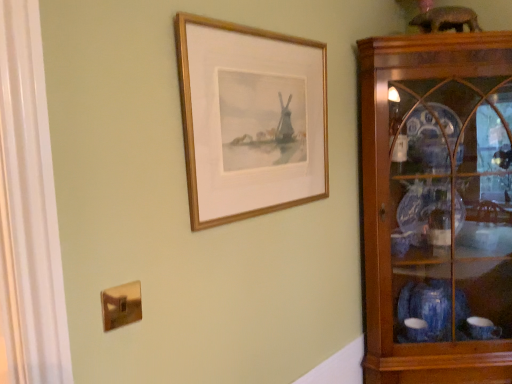
Identify the location of gold wood picture frame at upper center. The width and height of the screenshot is (512, 384). (250, 119).

The height and width of the screenshot is (384, 512). What do you see at coordinates (250, 119) in the screenshot?
I see `gold wood picture frame at upper center` at bounding box center [250, 119].

Measure the distance between gold wood picture frame at upper center and camera.

The depth of gold wood picture frame at upper center is 93.90 centimeters.

Locate an element on the screen. wooden cabinet at right is located at coordinates (437, 207).

Describe the element at coordinates (437, 207) in the screenshot. I see `wooden cabinet at right` at that location.

Where is `gold wood picture frame at upper center`? gold wood picture frame at upper center is located at coordinates (250, 119).

Between wooden cabinet at right and gold wood picture frame at upper center, which one appears on the right side from the viewer's perspective?

wooden cabinet at right.

Between wooden cabinet at right and gold wood picture frame at upper center, which one is positioned behind?

wooden cabinet at right is further away from the camera.

Which is in front, point (415, 309) or point (224, 36)?

The point (224, 36) is in front.

From the image's perspective, which one is positioned higher, wooden cabinet at right or gold wood picture frame at upper center?

gold wood picture frame at upper center.

From a real-world perspective, does wooden cabinet at right stand above gold wood picture frame at upper center?

No, from a real-world perspective, wooden cabinet at right is not over gold wood picture frame at upper center

Which object is wider, wooden cabinet at right or gold wood picture frame at upper center?

With larger width is wooden cabinet at right.

Who is shorter, wooden cabinet at right or gold wood picture frame at upper center?

Standing shorter between the two is gold wood picture frame at upper center.

Between wooden cabinet at right and gold wood picture frame at upper center, which one has smaller size?

gold wood picture frame at upper center.

Would you say gold wood picture frame at upper center is part of wooden cabinet at right's contents?

Actually, gold wood picture frame at upper center is outside wooden cabinet at right.

Is wooden cabinet at right touching gold wood picture frame at upper center?

They are not placed beside each other.

Is wooden cabinet at right facing away from gold wood picture frame at upper center?

wooden cabinet at right does not have its back to gold wood picture frame at upper center.

Can you tell me how much wooden cabinet at right and gold wood picture frame at upper center differ in facing direction?

46.7 degrees separate the facing orientations of wooden cabinet at right and gold wood picture frame at upper center.

Locate an element on the screen. This screenshot has width=512, height=384. picture frame located above the wooden cabinet at right (from a real-world perspective) is located at coordinates (250, 119).

Considering the relative positions of gold wood picture frame at upper center and wooden cabinet at right in the image provided, is gold wood picture frame at upper center to the left or to the right of wooden cabinet at right?

gold wood picture frame at upper center is to the left of wooden cabinet at right.

Considering their positions, is gold wood picture frame at upper center located in front of or behind wooden cabinet at right?

gold wood picture frame at upper center is in front of wooden cabinet at right.

Based on the photo, which is less distant, (307, 80) or (482, 99)?

Point (307, 80) appears to be closer to the viewer than point (482, 99).

From the image's perspective, would you say gold wood picture frame at upper center is positioned over wooden cabinet at right?

Indeed, from the image's perspective, gold wood picture frame at upper center is shown above wooden cabinet at right.

From a real-world perspective, which is physically below, gold wood picture frame at upper center or wooden cabinet at right?

wooden cabinet at right.

Does gold wood picture frame at upper center have a lesser width compared to wooden cabinet at right?

Indeed, gold wood picture frame at upper center has a lesser width compared to wooden cabinet at right.

Can you confirm if gold wood picture frame at upper center is shorter than wooden cabinet at right?

Correct, gold wood picture frame at upper center is not as tall as wooden cabinet at right.

Which of these two, gold wood picture frame at upper center or wooden cabinet at right, is bigger?

wooden cabinet at right.

Looking at this image, is wooden cabinet at right a part of gold wood picture frame at upper center?

No, wooden cabinet at right is not a part of gold wood picture frame at upper center.

Is gold wood picture frame at upper center with wooden cabinet at right?

No, gold wood picture frame at upper center is not making contact with wooden cabinet at right.

Does gold wood picture frame at upper center turn towards wooden cabinet at right?

No, gold wood picture frame at upper center is not facing towards wooden cabinet at right.

How many degrees apart are the facing directions of gold wood picture frame at upper center and wooden cabinet at right?

The angular difference between gold wood picture frame at upper center and wooden cabinet at right is 46.7 degrees.

I want to click on picture frame that appears above the wooden cabinet at right (from a real-world perspective), so click(250, 119).

Where is `picture frame on the left of wooden cabinet at right`? The width and height of the screenshot is (512, 384). picture frame on the left of wooden cabinet at right is located at coordinates (250, 119).

Identify the location of shelf below the gold wood picture frame at upper center (from the image's perspective). Image resolution: width=512 pixels, height=384 pixels. (437, 207).